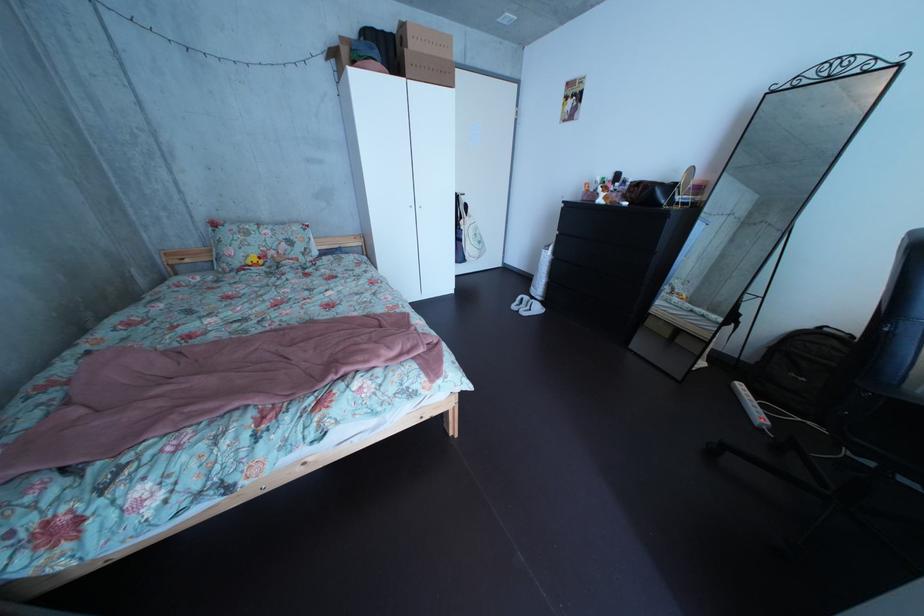
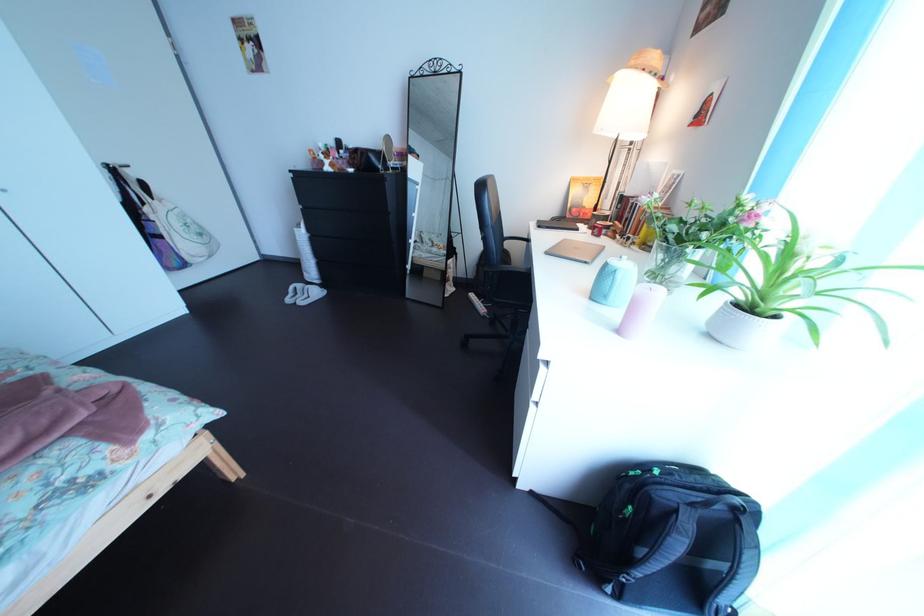
Question: How did the camera likely rotate?

Choices:
 (A) Left
 (B) Right
 (C) Up
 (D) Down

Answer: (B)